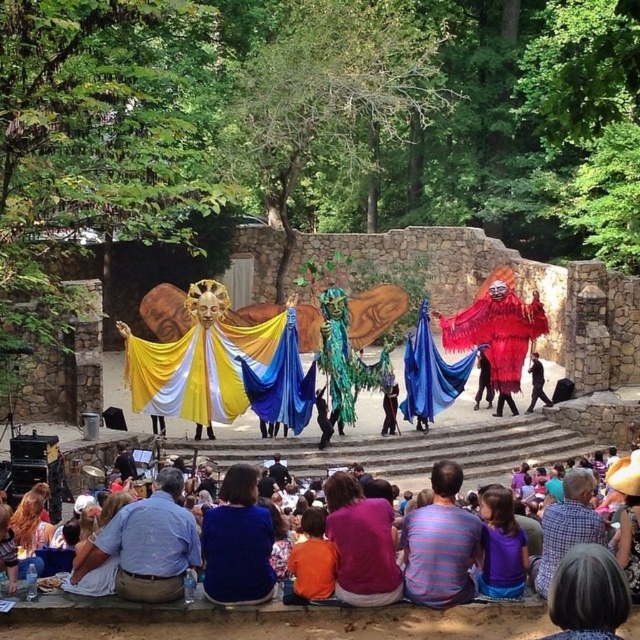
Does yellow satin cape at center have a smaller size compared to purple fabric shirt at center?

Incorrect, yellow satin cape at center is not smaller in size than purple fabric shirt at center.

Can you confirm if yellow satin cape at center is thinner than purple fabric shirt at center?

No.

Does point (244, 353) come in front of point (369, 540)?

No, it is not.

I want to click on yellow satin cape at center, so click(221, 372).

Does blue fabric at center have a greater width compared to purple cotton shirt at lower center?

Yes.

Which is in front, point (252, 548) or point (524, 576)?

Positioned in front is point (252, 548).

What do you see at coordinates (237, 541) in the screenshot? The image size is (640, 640). I see `blue fabric at center` at bounding box center [237, 541].

Find the location of a particular element. Image resolution: width=640 pixels, height=640 pixels. blue fabric at center is located at coordinates (237, 541).

Which is above, striped cotton shirt at lower center or blue fabric at center?

blue fabric at center

Can you confirm if striped cotton shirt at lower center is thinner than blue fabric at center?

Yes, striped cotton shirt at lower center is thinner than blue fabric at center.

This screenshot has height=640, width=640. Describe the element at coordinates (440, 544) in the screenshot. I see `striped cotton shirt at lower center` at that location.

Find the location of a particular element. The width and height of the screenshot is (640, 640). striped cotton shirt at lower center is located at coordinates (440, 544).